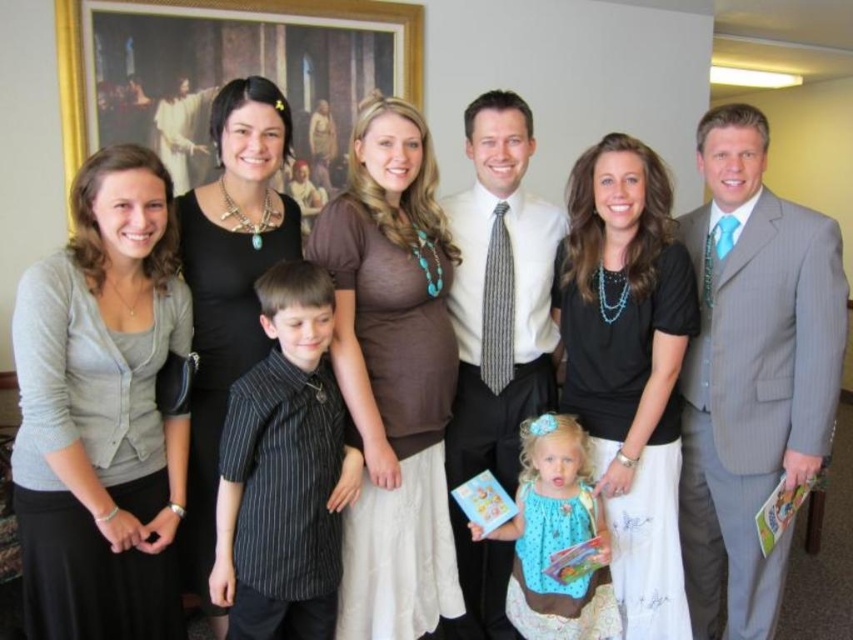
At what (x,y) coordinates should I click in order to perform the action: click on gray cardigan at left. Please return your answer as a coordinate pair (x, y). Looking at the image, I should click on (102, 412).

Is point (114, 244) positioned after point (274, 557)?

No, (114, 244) is in front of (274, 557).

Find the location of a particular element. Image resolution: width=853 pixels, height=640 pixels. gray cardigan at left is located at coordinates (102, 412).

Is gray cardigan at left further to camera compared to polka dot fabric dress at center?

No, gray cardigan at left is in front of polka dot fabric dress at center.

Is gray cardigan at left bigger than polka dot fabric dress at center?

Indeed, gray cardigan at left has a larger size compared to polka dot fabric dress at center.

Where is `gray cardigan at left`? gray cardigan at left is located at coordinates (102, 412).

Does brown fabric dress at center lie in front of black fabric dress at center?

That is True.

Is brown fabric dress at center shorter than black fabric dress at center?

Incorrect, brown fabric dress at center's height does not fall short of black fabric dress at center's.

Locate an element on the screen. brown fabric dress at center is located at coordinates (393, 374).